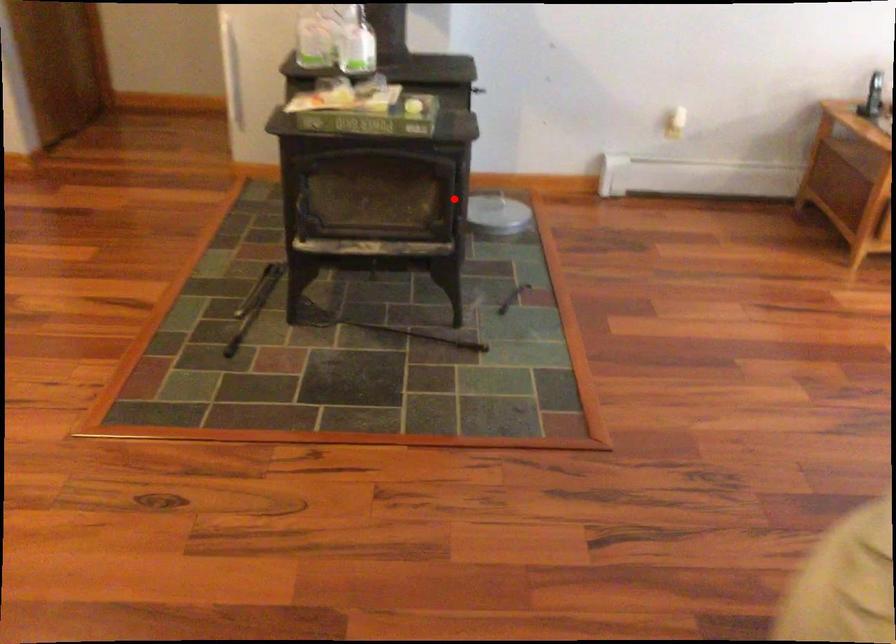
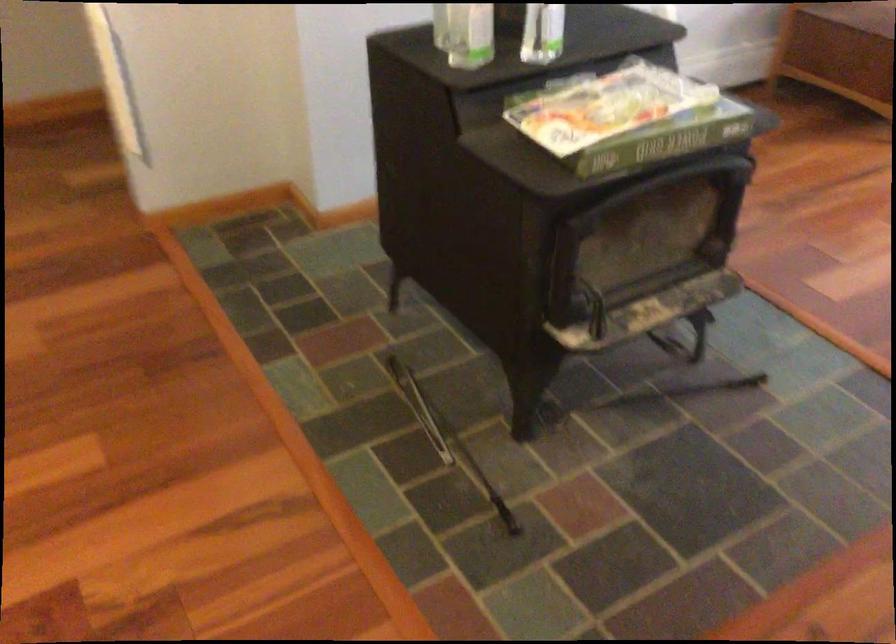
Question: I am providing you with two images of the same scene from different viewpoints. Given a red point in image1, look at the same physical point in image2. Is it:

Choices:
 (A) Closer to the viewpoint
 (B) Farther from the viewpoint

Answer: (B)